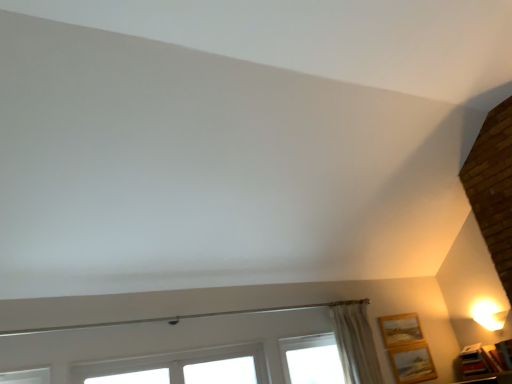
Question: Would you say white plastic window at lower center is inside or outside wooden picture frame at lower right, the second picture frame when ordered from left to right?

Choices:
 (A) outside
 (B) inside

Answer: (A)

Question: In the image, is white plastic window at lower center positioned in front of or behind wooden picture frame at lower right, the second picture frame when ordered from left to right?

Choices:
 (A) front
 (B) behind

Answer: (A)

Question: Which of these objects is positioned farthest from the wooden picture frame at lower right, positioned as the third picture frame in left-to-right order?

Choices:
 (A) wooden picture frame at lower right, arranged as the 2th picture frame when viewed from the right
 (B) beige textured curtain at upper right
 (C) wooden picture frame at lower right, the first picture frame from the left
 (D) white plastic window at lower center
 (E) white glossy table lamp at upper right

Answer: (D)

Question: Which object is positioned closest to the wooden picture frame at lower right, the second picture frame when ordered from left to right?

Choices:
 (A) wooden picture frame at lower right, which is counted as the first picture frame, starting from the right
 (B) white glossy table lamp at upper right
 (C) wooden picture frame at lower right, the first picture frame from the left
 (D) white plastic window at lower center
 (E) beige textured curtain at upper right

Answer: (C)